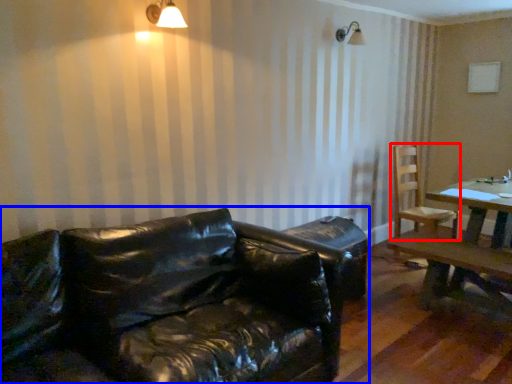
Question: Among these objects, which one is farthest to the camera, chair (highlighted by a red box) or studio couch (highlighted by a blue box)?

Choices:
 (A) chair
 (B) studio couch

Answer: (A)